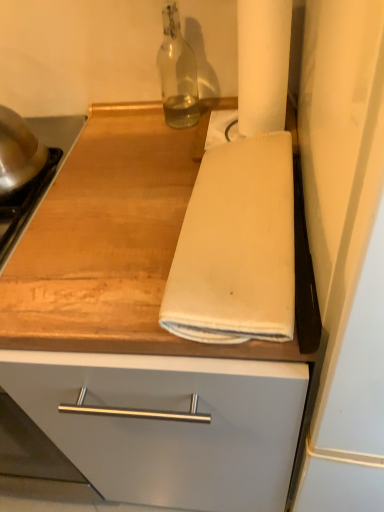
What are the coordinates of `white matte paper towel at upper right` in the screenshot? It's located at (263, 64).

This screenshot has height=512, width=384. I want to click on white matte paper towel at upper right, so click(x=263, y=64).

From a real-world perspective, is transparent glass bottle at upper center located beneath white matte paper towel at upper right?

Yes, from a real-world perspective, transparent glass bottle at upper center is below white matte paper towel at upper right.

The image size is (384, 512). I want to click on bottle behind the white matte paper towel at upper right, so click(x=177, y=73).

Between transparent glass bottle at upper center and white matte paper towel at upper right, which one appears on the right side from the viewer's perspective?

white matte paper towel at upper right.

Could you tell me if transparent glass bottle at upper center is turned towards white matte paper towel at upper right?

No, transparent glass bottle at upper center is not oriented towards white matte paper towel at upper right.

Would you say wooden at center contains white cotton towel at center?

Yes, white cotton towel at center is a part of wooden at center.

How different are the orientations of wooden at center and white cotton towel at center in degrees?

The facing directions of wooden at center and white cotton towel at center are 90.3 degrees apart.

You are a GUI agent. You are given a task and a screenshot of the screen. Output one action in this format:
    pyautogui.click(x=<x>, y=<y>)
    Task: Click on the bath towel behind the wooden at center
    This screenshot has height=512, width=384.
    Given the screenshot: What is the action you would take?
    pyautogui.click(x=236, y=247)

Is point (288, 301) closer to camera compared to point (272, 441)?

Yes, it is in front of point (272, 441).

From a real-world perspective, is white cotton towel at center over wooden at center?

Yes, from a real-world perspective, white cotton towel at center is on top of wooden at center.

Looking at their sizes, would you say white cotton towel at center is wider or thinner than wooden at center?

Result: Clearly, white cotton towel at center has less width compared to wooden at center.

Is white cotton towel at center bigger or smaller than wooden at center?

Considering their sizes, white cotton towel at center takes up less space than wooden at center.

Can you confirm if white matte paper towel at upper right is thinner than white cotton towel at center?

Yes, white matte paper towel at upper right is thinner than white cotton towel at center.

From the image's perspective, which object appears higher, white matte paper towel at upper right or white cotton towel at center?

white matte paper towel at upper right appears higher in the image.

Which is closer to the camera, (285, 41) or (213, 249)?

The point (213, 249) is closer.

Does white matte paper towel at upper right come behind white cotton towel at center?

Yes, it is behind white cotton towel at center.

Which is behind, white cotton towel at center or white matte paper towel at upper right?

white matte paper towel at upper right is more distant.

From the image's perspective, which is above, white cotton towel at center or white matte paper towel at upper right?

From the image's view, white matte paper towel at upper right is above.

Is white cotton towel at center facing away from white matte paper towel at upper right?

No, white matte paper towel at upper right is not at the back of white cotton towel at center.

In the scene shown: From the image's perspective, between transparent glass bottle at upper center and wooden at center, which one is located above?

From the image's view, transparent glass bottle at upper center is above.

Considering the relative sizes of transparent glass bottle at upper center and wooden at center in the image provided, is transparent glass bottle at upper center shorter than wooden at center?

Yes, transparent glass bottle at upper center is shorter than wooden at center.

Looking at this image, between transparent glass bottle at upper center and wooden at center, which one has smaller size?

transparent glass bottle at upper center.

In terms of width, does transparent glass bottle at upper center look wider or thinner when compared to wooden at center?

Considering their sizes, transparent glass bottle at upper center looks slimmer than wooden at center.

Is wooden at center smaller than white matte paper towel at upper right?

No, wooden at center is not smaller than white matte paper towel at upper right.

From the image's perspective, is wooden at center located above or below white matte paper towel at upper right?

Clearly, from the image's perspective, wooden at center is below white matte paper towel at upper right.

Considering the relative sizes of wooden at center and white matte paper towel at upper right in the image provided, is wooden at center taller than white matte paper towel at upper right?

Correct, wooden at center is much taller as white matte paper towel at upper right.

This screenshot has height=512, width=384. Find the location of `paper towel located below the transparent glass bottle at upper center (from the image's perspective)`. paper towel located below the transparent glass bottle at upper center (from the image's perspective) is located at coordinates (263, 64).

This screenshot has height=512, width=384. In order to click on bath towel above the wooden at center (from a real-world perspective) in this screenshot , I will do `click(236, 247)`.

Estimate the real-world distances between objects in this image. Which object is further from transparent glass bottle at upper center, white cotton towel at center or white matte paper towel at upper right?

Based on the image, white cotton towel at center appears to be further to transparent glass bottle at upper center.

Based on their spatial positions, is white cotton towel at center or white matte paper towel at upper right closer to wooden at center?

Among the two, white cotton towel at center is located nearer to wooden at center.

Considering their positions, is white cotton towel at center positioned further to white matte paper towel at upper right than transparent glass bottle at upper center?

Based on the image, white cotton towel at center appears to be further to white matte paper towel at upper right.

Considering their positions, is transparent glass bottle at upper center positioned further to wooden at center than white matte paper towel at upper right?

transparent glass bottle at upper center is positioned further to the anchor wooden at center.

Estimate the real-world distances between objects in this image. Which object is closer to white cotton towel at center, wooden at center or transparent glass bottle at upper center?

wooden at center is positioned closer to the anchor white cotton towel at center.

Estimate the real-world distances between objects in this image. Which object is closer to white matte paper towel at upper right, transparent glass bottle at upper center or wooden at center?

Based on the image, transparent glass bottle at upper center appears to be nearer to white matte paper towel at upper right.

Looking at the image, which one is located further to white matte paper towel at upper right, wooden at center or transparent glass bottle at upper center?

The object further to white matte paper towel at upper right is wooden at center.

Estimate the real-world distances between objects in this image. Which object is closer to white cotton towel at center, white matte paper towel at upper right or wooden at center?

wooden at center is positioned closer to the anchor white cotton towel at center.

The width and height of the screenshot is (384, 512). Find the location of `paper towel between transparent glass bottle at upper center and white cotton towel at center from top to bottom`. paper towel between transparent glass bottle at upper center and white cotton towel at center from top to bottom is located at coordinates (263, 64).

This screenshot has height=512, width=384. Identify the location of bath towel between transparent glass bottle at upper center and wooden at center in the up-down direction. (236, 247).

Locate an element on the screen. This screenshot has height=512, width=384. bath towel between white matte paper towel at upper right and wooden at center vertically is located at coordinates (236, 247).

Where is `paper towel between transparent glass bottle at upper center and wooden at center in the up-down direction`? paper towel between transparent glass bottle at upper center and wooden at center in the up-down direction is located at coordinates (263, 64).